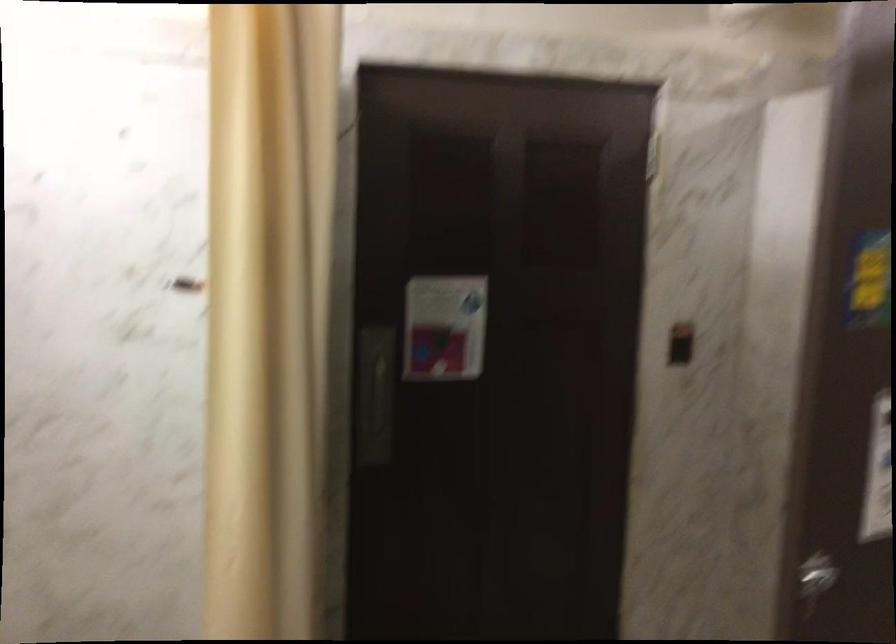
Describe the element at coordinates (383, 395) in the screenshot. The height and width of the screenshot is (644, 896). I see `the recessed door handle` at that location.